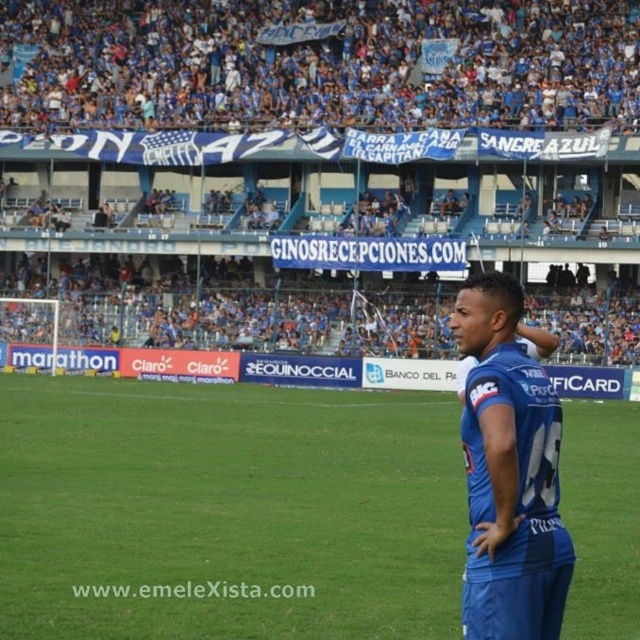
You are a photographer at the soccer stadium. You need to capture a photo where the blue fabric field at center and the blue fabric uniform at right are both visible. Based on their positions, which object should appear lower in the photo?

The blue fabric field at center appears lower in the photo because it is positioned below the blue fabric uniform at right.

You are a soccer fan attending the match and want to take a photo of the blue fabric field at center and the blue jersey at right. Since you want both objects to be clearly visible, which one should you zoom in on more to ensure they both fit in the frame?

The blue fabric field at center is narrower than the blue jersey at right, so you should zoom in more on the blue jersey at right to ensure both fit in the frame.

You are a photographer at the soccer stadium and want to capture a photo of the blue jersey at right and the blue fabric uniform at right. Which one is positioned higher in the image?

The blue jersey at right is positioned higher than the blue fabric uniform at right in the image.